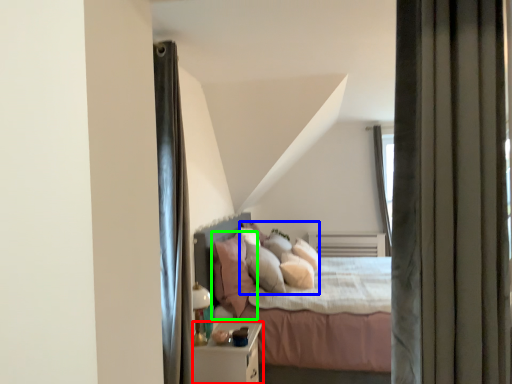
Question: Which object is the farthest from nightstand (highlighted by a red box)? Choose among these: pillow (highlighted by a blue box) or pillow (highlighted by a green box).

Choices:
 (A) pillow
 (B) pillow

Answer: (A)